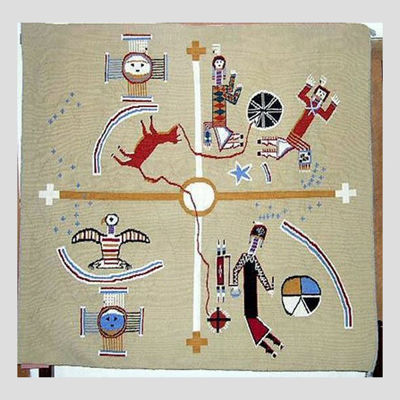
You are a GUI agent. You are given a task and a screenshot of the screen. Output one action in this format:
    pyautogui.click(x=<x>, y=<y>)
    Task: Click on the upper right corner of tapestry
    The image size is (400, 400).
    Given the screenshot: What is the action you would take?
    pyautogui.click(x=366, y=30)